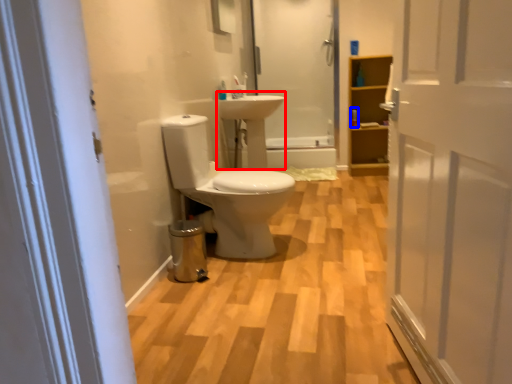
Question: Which object appears farthest to the camera in this image, sink (highlighted by a red box) or toiletry (highlighted by a blue box)?

Choices:
 (A) sink
 (B) toiletry

Answer: (B)